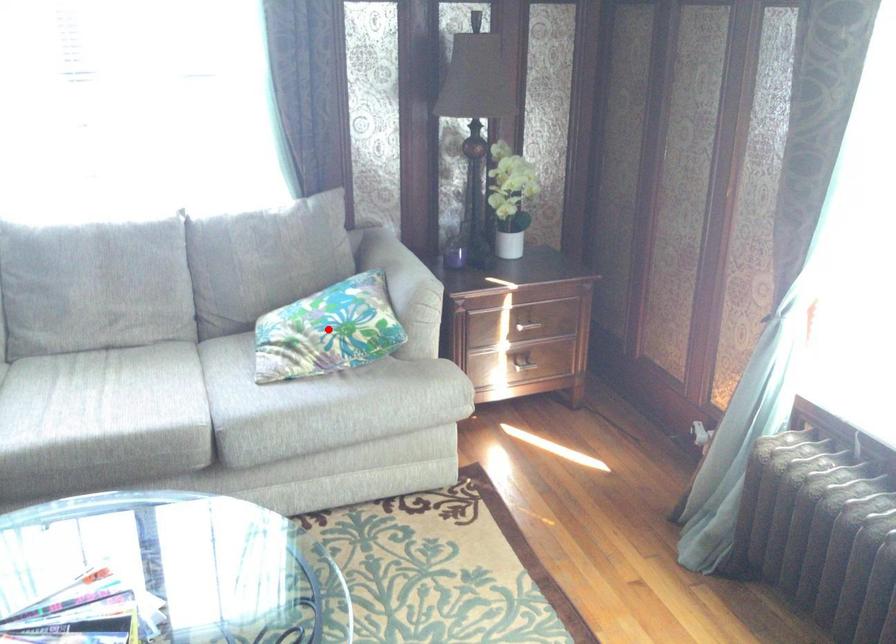
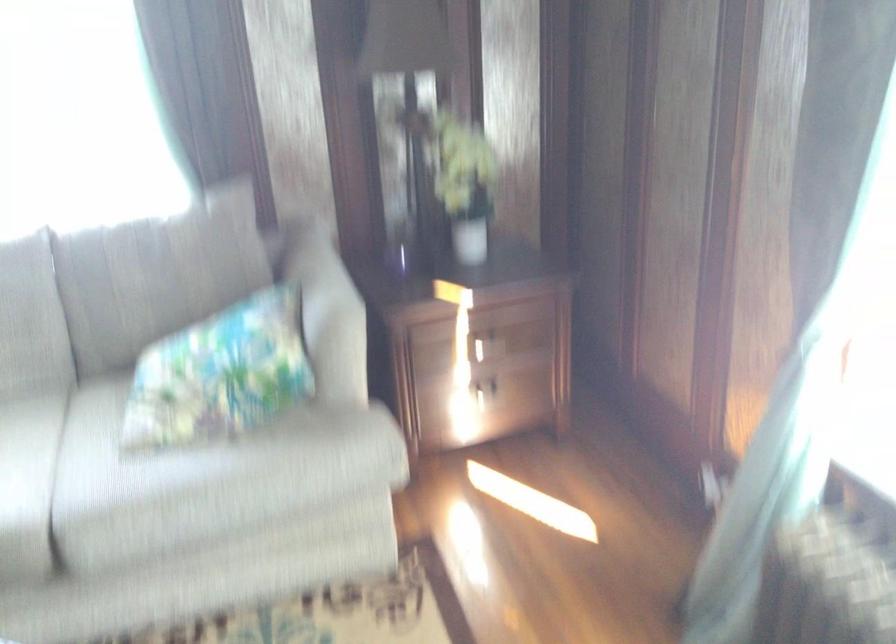
Question: I am providing you with two images of the same scene from different viewpoints. A red point is shown in image1. For the corresponding object point in image2, is it positioned nearer or farther from the camera?

Choices:
 (A) Nearer
 (B) Farther

Answer: (A)